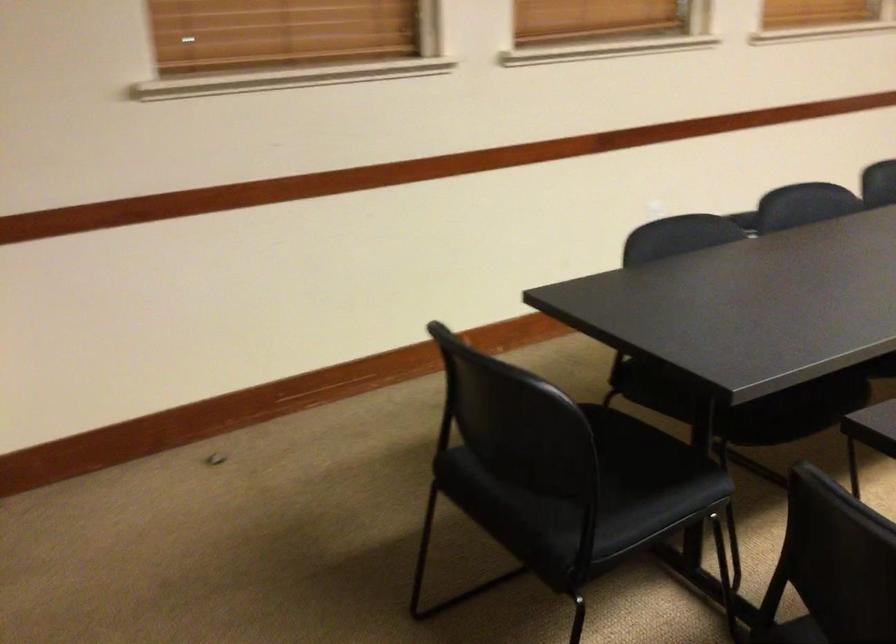
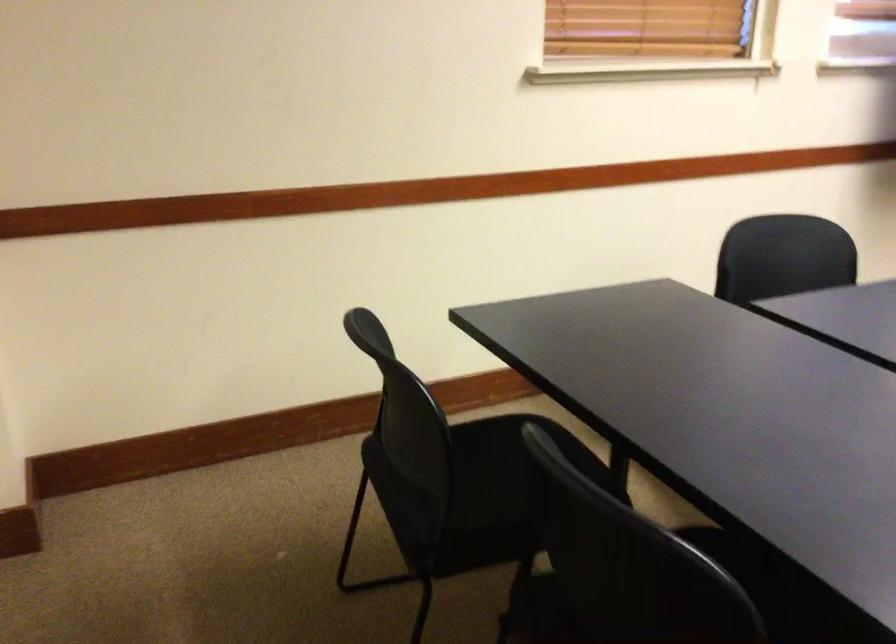
The images are taken continuously from a first-person perspective. In which direction is your viewpoint rotating?

The camera rotated toward right-down.